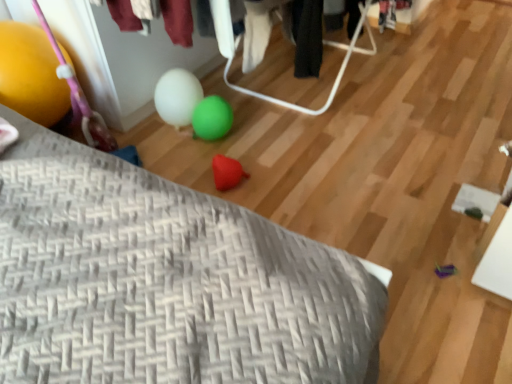
At what (x,y) coordinates should I click in order to perform the action: click on vacant area located to the right-hand side of rubber heart at center. Please return your answer as a coordinate pair (x, y). This screenshot has width=512, height=384. Looking at the image, I should click on (278, 178).